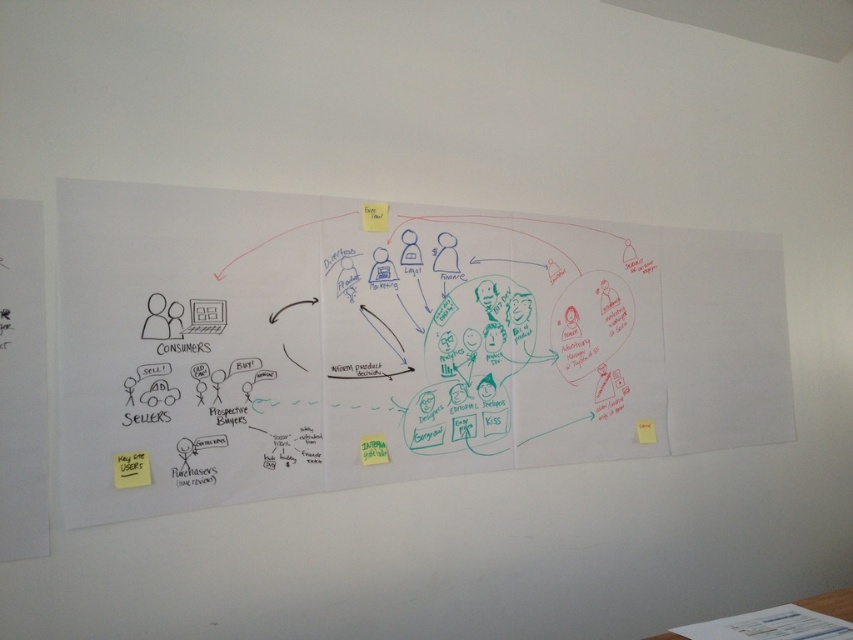
Question: Among these objects, which one is nearest to the camera?

Choices:
 (A) green paper at center
 (B) yellow sticky note at lower left
 (C) yellow sticky note at upper center

Answer: (B)

Question: Is white paper at center thinner than green paper at center?

Choices:
 (A) yes
 (B) no

Answer: (B)

Question: Which of the following is the closest to the observer?

Choices:
 (A) yellow sticky note at upper center
 (B) white paper at center
 (C) green paper at center

Answer: (B)

Question: From the image, what is the correct spatial relationship of white paper at center in relation to green paper at center?

Choices:
 (A) below
 (B) above

Answer: (B)

Question: Among these points, which one is farthest from the camera?

Choices:
 (A) (148, 468)
 (B) (650, 436)
 (C) (375, 205)

Answer: (B)

Question: Is white paper at center in front of yellow paper at bottom right?

Choices:
 (A) no
 (B) yes

Answer: (B)